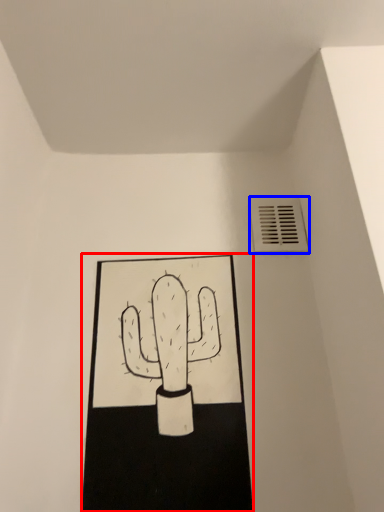
Question: Among these objects, which one is nearest to the camera, sketch (highlighted by a red box) or air conditioning (highlighted by a blue box)?

Choices:
 (A) sketch
 (B) air conditioning

Answer: (A)